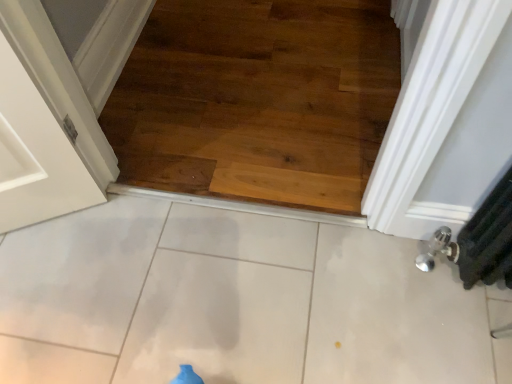
The height and width of the screenshot is (384, 512). What are the coordinates of `wooden floor at center` in the screenshot? It's located at (257, 100).

This screenshot has height=384, width=512. What do you see at coordinates (257, 100) in the screenshot?
I see `wooden floor at center` at bounding box center [257, 100].

Image resolution: width=512 pixels, height=384 pixels. Find the location of `wooden floor at center`. wooden floor at center is located at coordinates (257, 100).